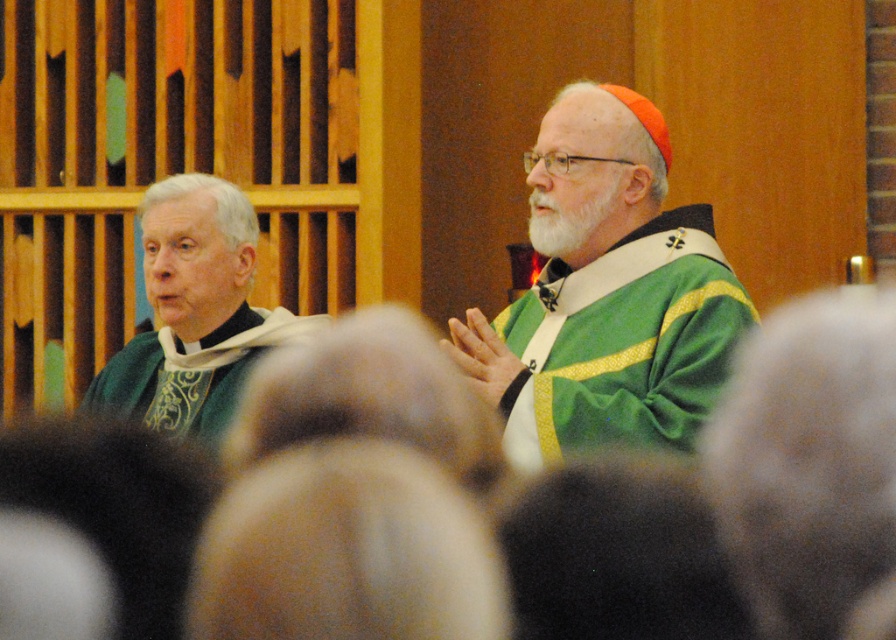
Question: Does green velvet robe at center appear under green velvet vestment at left?

Choices:
 (A) no
 (B) yes

Answer: (A)

Question: Among these points, which one is farthest from the camera?

Choices:
 (A) (515, 422)
 (B) (231, 369)

Answer: (B)

Question: Does green velvet robe at center appear under green velvet vestment at left?

Choices:
 (A) yes
 (B) no

Answer: (B)

Question: Does green velvet robe at center lie behind green velvet vestment at left?

Choices:
 (A) no
 (B) yes

Answer: (A)

Question: Which point is closer to the camera taking this photo?

Choices:
 (A) (248, 349)
 (B) (659, 180)

Answer: (B)